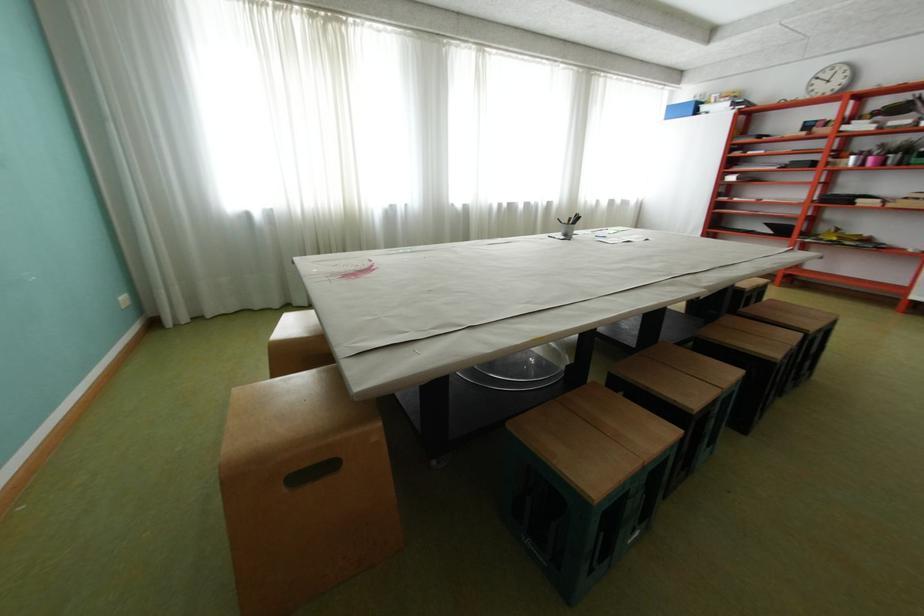
Where would you pull the wooden stool handle? Please return your answer as a coordinate pair (x, y).

(311, 472)